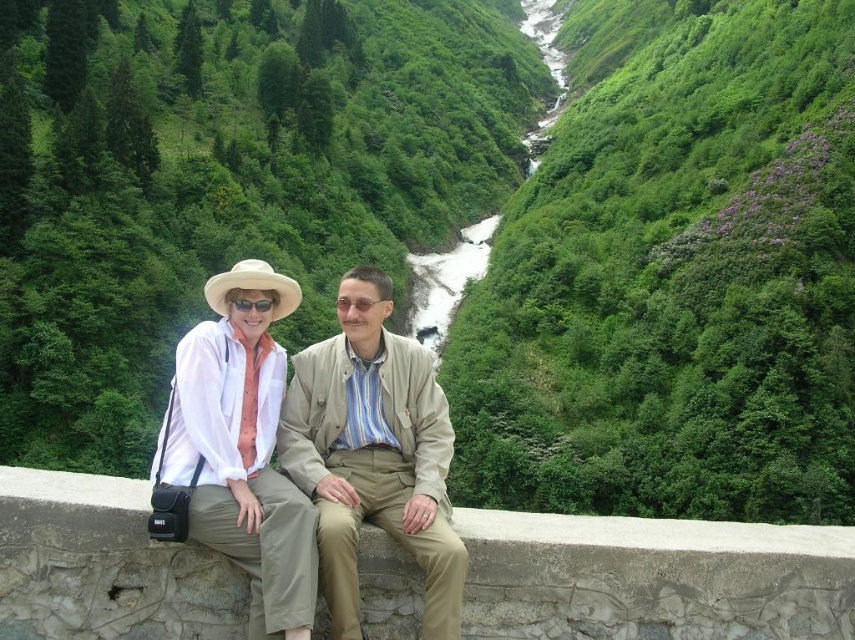
Does beige fabric jacket at center have a smaller size compared to white matte hat at upper left?

Yes, beige fabric jacket at center is smaller than white matte hat at upper left.

Does point (352, 378) come farther from viewer compared to point (273, 410)?

Yes, point (352, 378) is behind point (273, 410).

Is point (407, 396) closer to viewer compared to point (198, 522)?

That is False.

In order to click on beige fabric jacket at center in this screenshot , I will do `click(373, 452)`.